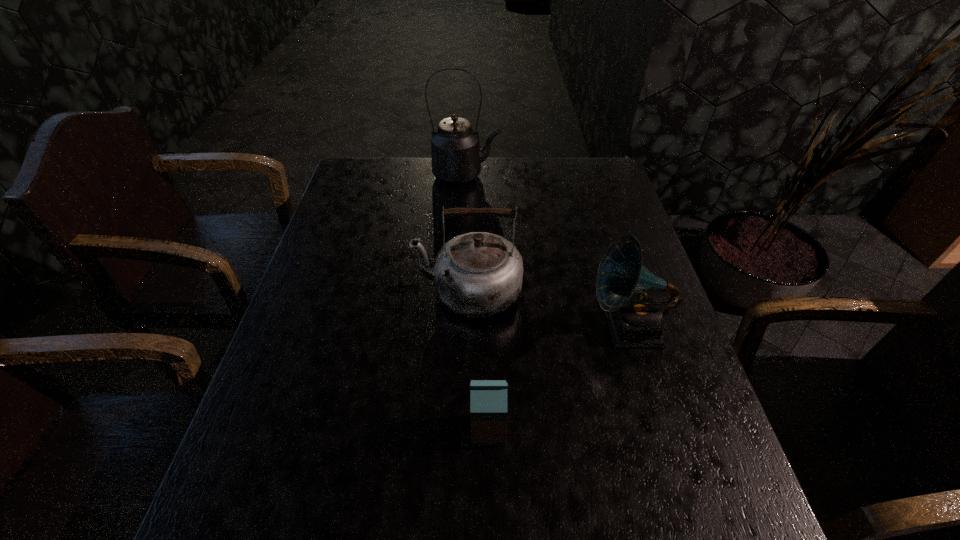
The height and width of the screenshot is (540, 960). In order to click on the farthest object in this screenshot , I will do `click(456, 156)`.

I want to click on the farther kettle, so click(x=456, y=156).

Locate an element on the screen. Image resolution: width=960 pixels, height=540 pixels. the nearer kettle is located at coordinates (478, 274).

Image resolution: width=960 pixels, height=540 pixels. In order to click on the rightmost object in this screenshot , I will do `click(635, 320)`.

The width and height of the screenshot is (960, 540). In order to click on milk carton in this screenshot , I will do `click(488, 398)`.

This screenshot has height=540, width=960. I want to click on the shortest object, so click(x=488, y=398).

Identify the location of vacant position located 0.250m spout on the farther kettle. (573, 176).

The width and height of the screenshot is (960, 540). I want to click on vacant area situated at the spout of the shorter kettle, so click(x=326, y=291).

Locate an element on the screen. vacant region located 0.240m at the spout of the shorter kettle is located at coordinates (323, 291).

You are a GUI agent. You are given a task and a screenshot of the screen. Output one action in this format:
    pyautogui.click(x=<x>, y=<y>)
    Task: Click on the free space located 0.250m at the spout of the shorter kettle
    
    Given the screenshot: What is the action you would take?
    pyautogui.click(x=319, y=291)